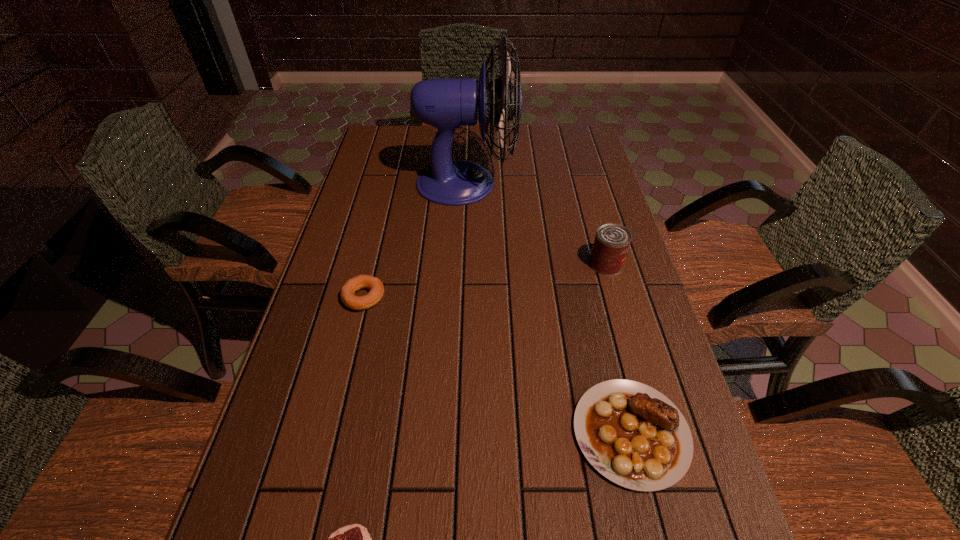
Locate an element on the screen. free spot that satisfies the following two spatial constraints: 1. in front of the farthest object where the airflow is directed; 2. on the right side of the can is located at coordinates pyautogui.click(x=463, y=264).

This screenshot has width=960, height=540. In order to click on free space in the image that satisfies the following two spatial constraints: 1. in front of the tallest object where the airflow is directed; 2. on the left side of the taller steak in this screenshot , I will do `click(457, 433)`.